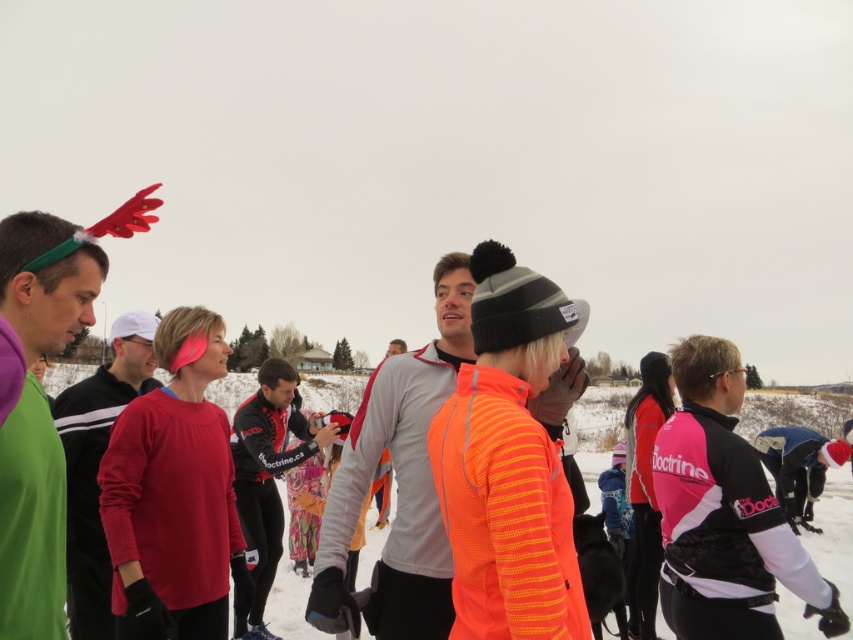
Is green matte headband at left above matte red sweater at center?

Correct, green matte headband at left is located above matte red sweater at center.

Which is in front, point (25, 544) or point (70, 458)?

Point (25, 544)

I want to click on green matte headband at left, so click(32, 522).

Find the location of a particular element. This screenshot has width=853, height=640. green matte headband at left is located at coordinates (32, 522).

Does neon orange knit sweater at center have a greater width compared to gray fleece jacket at center?

Correct, the width of neon orange knit sweater at center exceeds that of gray fleece jacket at center.

Does neon orange knit sweater at center have a lesser width compared to gray fleece jacket at center?

Incorrect, neon orange knit sweater at center's width is not less than gray fleece jacket at center's.

Measure the distance between point (488, 561) and camera.

A distance of 3.64 meters exists between point (488, 561) and camera.

At what (x,y) coordinates should I click in order to perform the action: click on neon orange knit sweater at center. Please return your answer as a coordinate pair (x, y). The width and height of the screenshot is (853, 640). Looking at the image, I should click on (508, 465).

Can you confirm if pink/white/synthetic jacket at right is smaller than orange fleece jacket at center?

Yes.

The width and height of the screenshot is (853, 640). Describe the element at coordinates (724, 513) in the screenshot. I see `pink/white/synthetic jacket at right` at that location.

At what (x,y) coordinates should I click in order to perform the action: click on pink/white/synthetic jacket at right. Please return your answer as a coordinate pair (x, y). Looking at the image, I should click on (724, 513).